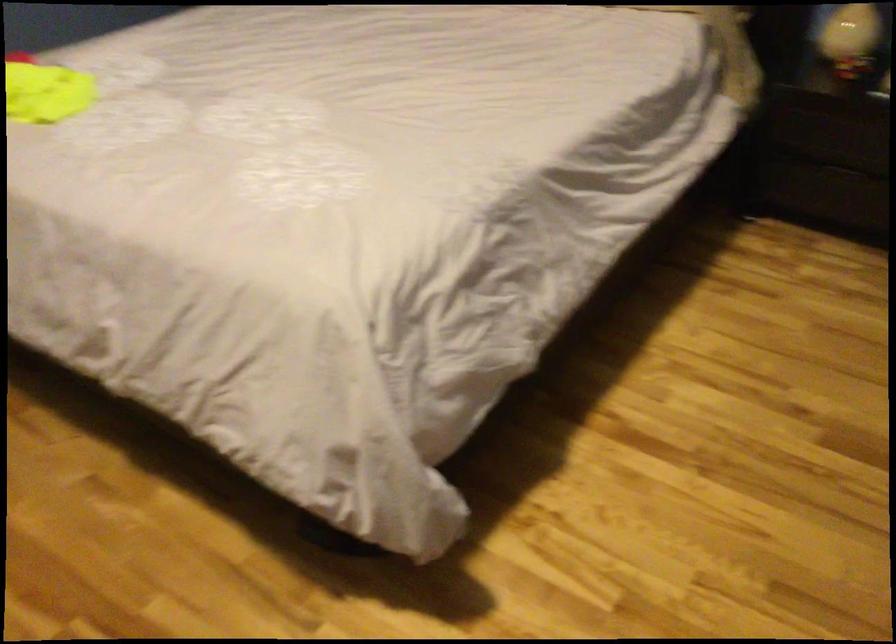
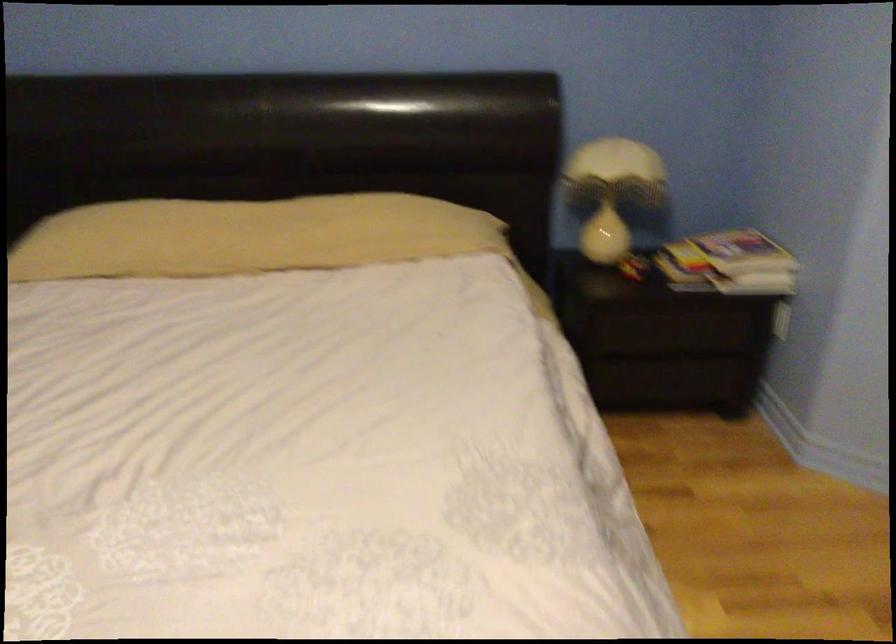
Question: The images are taken continuously from a first-person perspective. In which direction is your viewpoint rotating?

Choices:
 (A) Left
 (B) Right
 (C) Up
 (D) Down

Answer: (B)